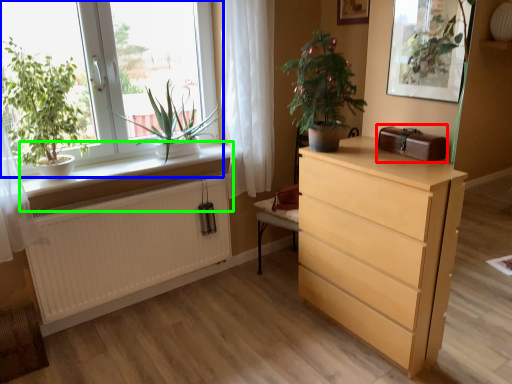
Question: Based on their relative distances, which object is farther from window box (highlighted by a red box)? Choose from window (highlighted by a blue box) and window sill (highlighted by a green box).

Choices:
 (A) window
 (B) window sill

Answer: (A)